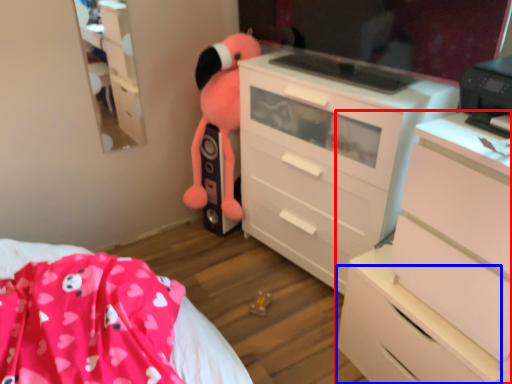
Question: Which object is closer to the camera taking this photo, chest of drawers (highlighted by a red box) or drawer (highlighted by a blue box)?

Choices:
 (A) chest of drawers
 (B) drawer

Answer: (A)